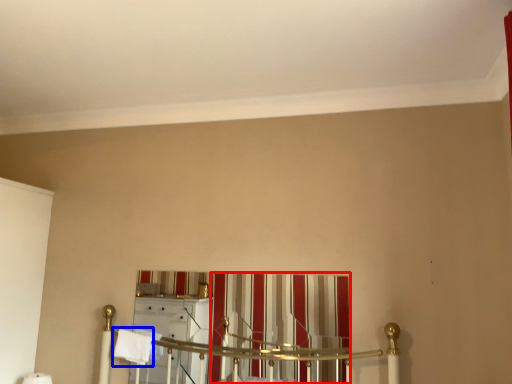
Question: Which of the following is the closest to the observer, curtain (highlighted by a red box) or bath towel (highlighted by a blue box)?

Choices:
 (A) curtain
 (B) bath towel

Answer: (A)